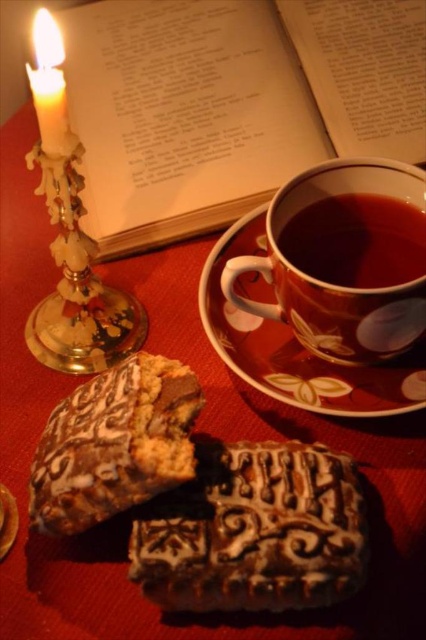
You are an interior designer analyzing this scene. You need to place a new decorative item exactly at the center of the image. However, you must ensure that this new item does not overlap with the gold metallic candle holder at left. Given its current position at point 0.444, 0.183, can you confirm whether the center of the image at point 0.5, 0.5 is a safe location for placement?

The gold metallic candle holder at left is located at point (x=77, y=284), which is not near the center point (x=213, y=320). Therefore, placing the new item at the center is safe and will not overlap with the gold metallic candle holder at left.

You are standing in the scene and want to place a new object exactly at the point marked by the coordinate point (232, 102). What object will you be placing it next to?

The point (232, 102) marks the paper book at upper center, so placing an object there would place it next to the paper book at upper center.